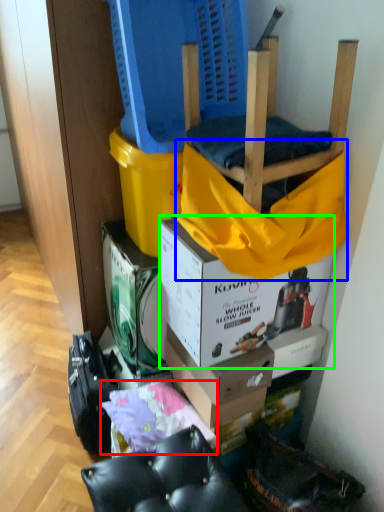
Question: Which object is positioned closest to material (highlighted by a red box)? Select from blanket (highlighted by a blue box) and box (highlighted by a green box).

Choices:
 (A) blanket
 (B) box

Answer: (B)